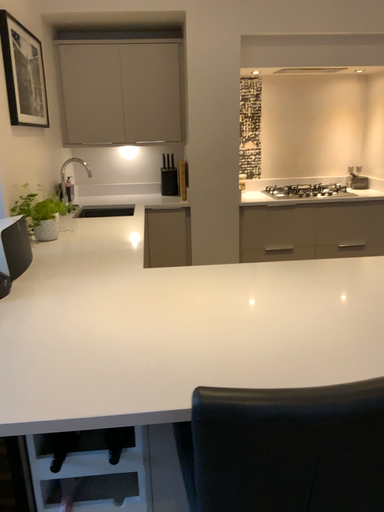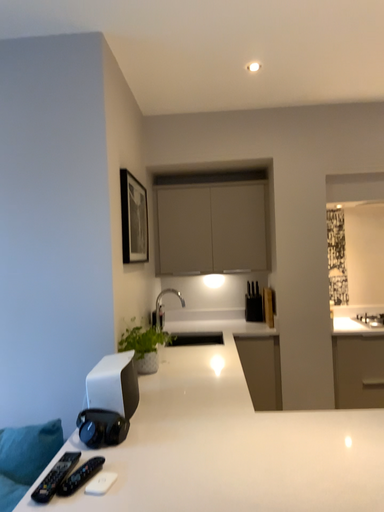
Question: Which way did the camera rotate in the video?

Choices:
 (A) rotated upward
 (B) rotated downward

Answer: (A)